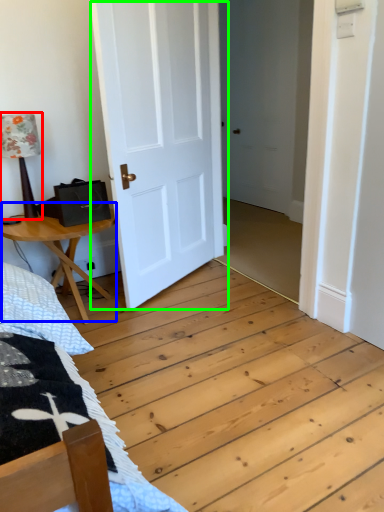
Question: Which object is the closest to the table lamp (highlighted by a red box)? Choose among these: table (highlighted by a blue box) or door (highlighted by a green box).

Choices:
 (A) table
 (B) door

Answer: (A)